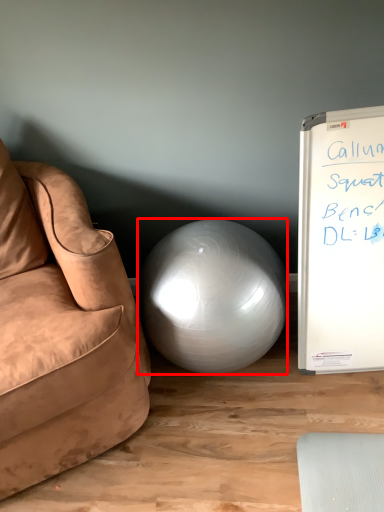
Question: Considering the relative positions of ball (annotated by the red box) and studio couch in the image provided, where is ball (annotated by the red box) located with respect to the staircase?

Choices:
 (A) right
 (B) left

Answer: (A)